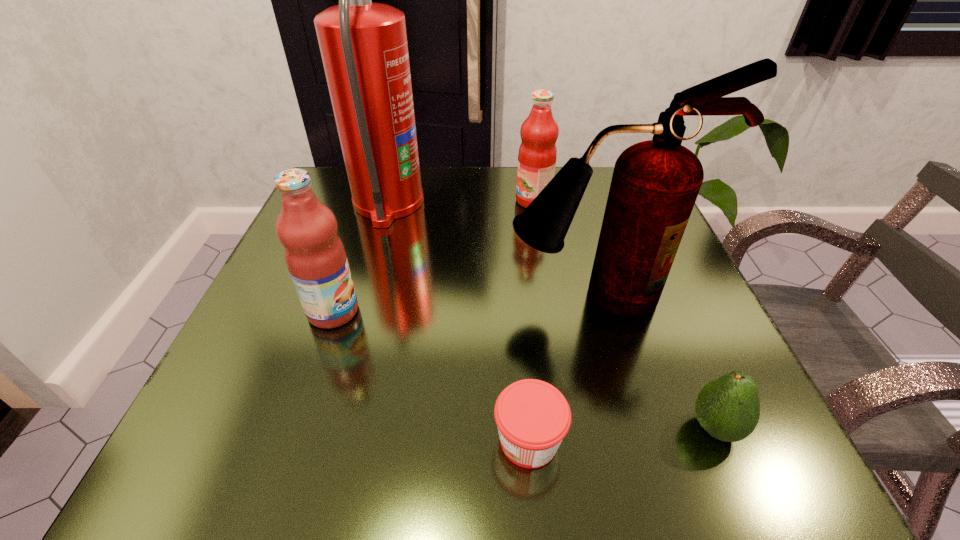
The image size is (960, 540). Identify the location of avocado that is positioned at the near edge. (728, 408).

Locate an element on the screen. The height and width of the screenshot is (540, 960). jam that is at the near edge is located at coordinates (532, 416).

You are a GUI agent. You are given a task and a screenshot of the screen. Output one action in this format:
    pyautogui.click(x=<x>, y=<y>)
    Task: Click on the fire extinguisher situated at the left edge
    The width and height of the screenshot is (960, 540).
    Given the screenshot: What is the action you would take?
    pyautogui.click(x=363, y=45)

You are a GUI agent. You are given a task and a screenshot of the screen. Output one action in this format:
    pyautogui.click(x=<x>, y=<y>)
    Task: Click on the fruit juice that is at the left edge
    This screenshot has height=540, width=960.
    Given the screenshot: What is the action you would take?
    pyautogui.click(x=315, y=256)

Where is `fire extinguisher at the right edge`? The image size is (960, 540). fire extinguisher at the right edge is located at coordinates (655, 183).

Locate an element on the screen. The image size is (960, 540). avocado that is at the right edge is located at coordinates (728, 408).

Where is `object present at the far left corner`? object present at the far left corner is located at coordinates (363, 45).

I want to click on object that is at the near right corner, so click(728, 408).

You are a GUI agent. You are given a task and a screenshot of the screen. Output one action in this format:
    pyautogui.click(x=<x>, y=<y>)
    Task: Click on the free space at the far edge
    
    Given the screenshot: What is the action you would take?
    pyautogui.click(x=434, y=170)

At what (x,y) coordinates should I click in order to perform the action: click on free space at the near edge of the desktop. Please return your answer as a coordinate pair (x, y). The image size is (960, 540). Looking at the image, I should click on (601, 479).